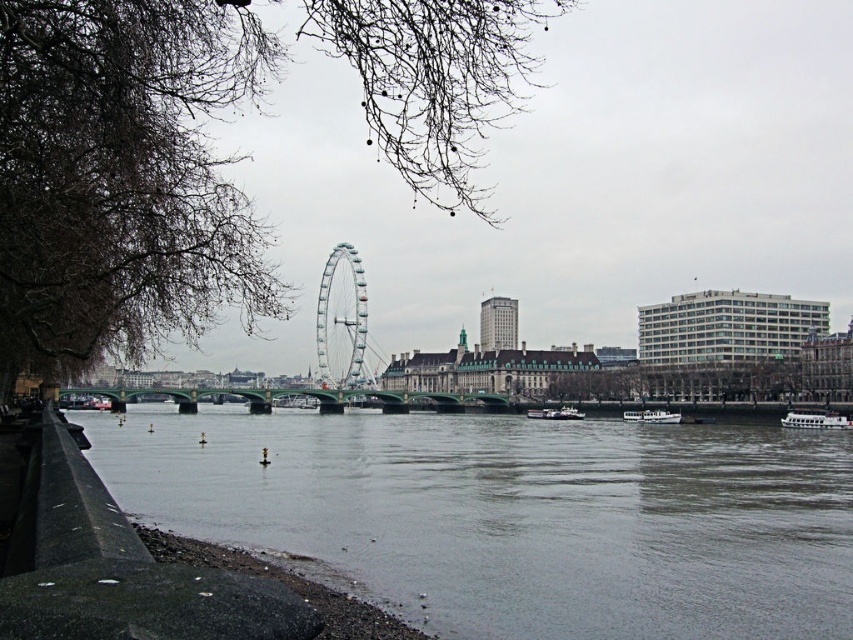
Consider the image. You are standing at the riverbank looking towards the green bridge. There are two points marked on the image, one at coordinates point (529,596) and another at point (833,416). Which point is closer to you?

Point (529,596) is closer to the camera than point (833,416), so the point at coordinates point (529,596) is closer to you.